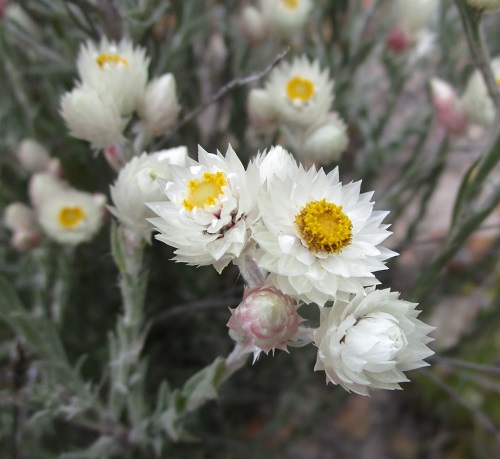
Locate an element on the screen. bulb is located at coordinates 277,327.